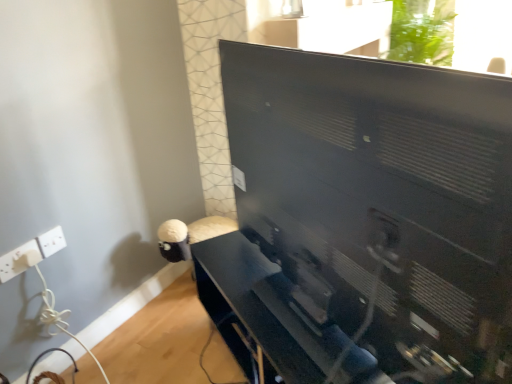
Question: Is matte black tv stand at center inside or outside of white plastic electric outlet at lower left, the 2th electric outlet viewed from the right?

Choices:
 (A) outside
 (B) inside

Answer: (A)

Question: Relative to white plastic electric outlet at lower left, the 1th electric outlet when ordered from left to right, is matte black tv stand at center in front or behind?

Choices:
 (A) behind
 (B) front

Answer: (B)

Question: Which object is the farthest from the black matte computer monitor at center?

Choices:
 (A) matte black tv stand at center
 (B) white plastic electric outlet at lower left, which is counted as the 2th electric outlet, starting from the left
 (C) white plastic electric outlet at lower left, the 1th electric outlet when ordered from left to right

Answer: (C)

Question: Which object is the farthest from the white plastic electric outlet at lower left, the 2th electric outlet viewed from the right?

Choices:
 (A) matte black tv stand at center
 (B) white plastic electric outlet at lower left, which is counted as the 2th electric outlet, starting from the left
 (C) black matte computer monitor at center

Answer: (C)